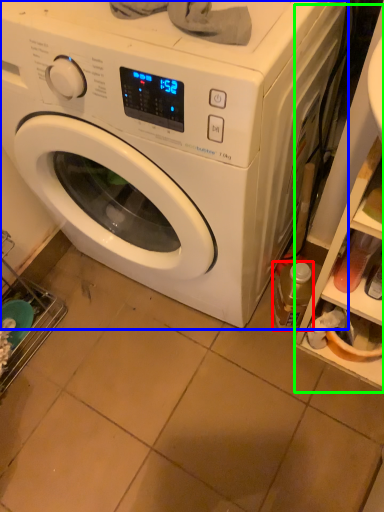
Question: Which object is the farthest from bottle (highlighted by a red box)? Choose among these: washing machine (highlighted by a blue box) or shelf (highlighted by a green box).

Choices:
 (A) washing machine
 (B) shelf

Answer: (A)